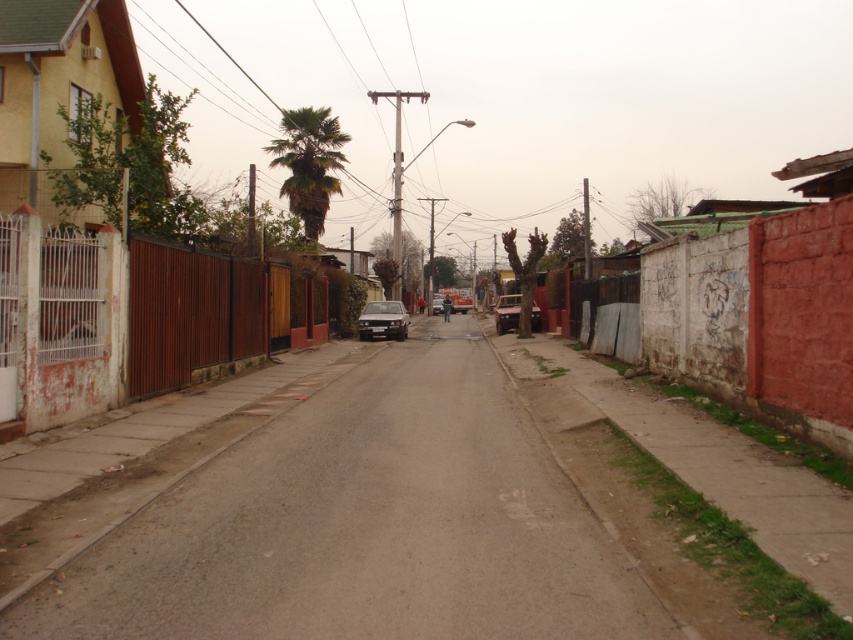
Question: Does green leafy palm at center have a larger size compared to satin black car at center?

Choices:
 (A) yes
 (B) no

Answer: (A)

Question: Which point is closer to the camera?

Choices:
 (A) smooth asphalt road at center
 (B) matte black car at center
 (C) satin black car at center
 (D) green leafy palm at center

Answer: (A)

Question: Which is farther from the smooth asphalt road at center?

Choices:
 (A) satin black car at center
 (B) matte black car at center

Answer: (B)

Question: Is green leafy palm at center to the right of matte black car at center from the viewer's perspective?

Choices:
 (A) yes
 (B) no

Answer: (B)

Question: Can you confirm if green leafy palm at center is wider than matte black car at center?

Choices:
 (A) yes
 (B) no

Answer: (A)

Question: Which of the following is the closest to the observer?

Choices:
 (A) smooth asphalt road at center
 (B) green leafy palm at center

Answer: (A)